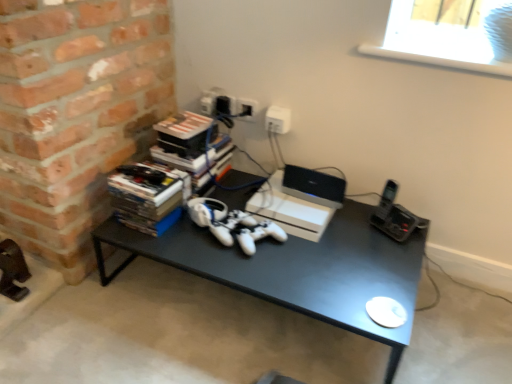
You are a GUI agent. You are given a task and a screenshot of the screen. Output one action in this format:
    pyautogui.click(x=<x>, y=<y>)
    Task: Click on the unoccupied region to the right of hardcover books at left
    This screenshot has height=384, width=512.
    Given the screenshot: What is the action you would take?
    pyautogui.click(x=183, y=239)